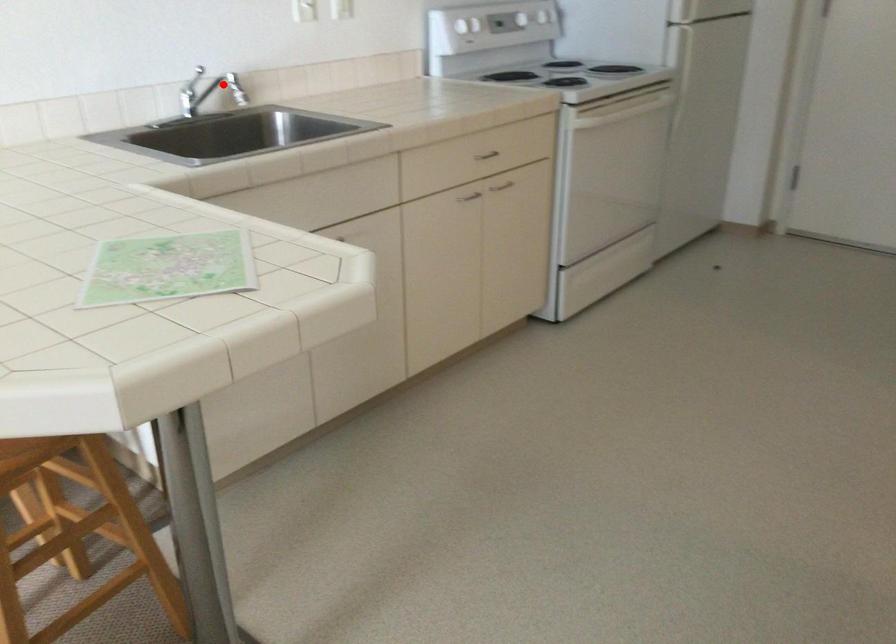
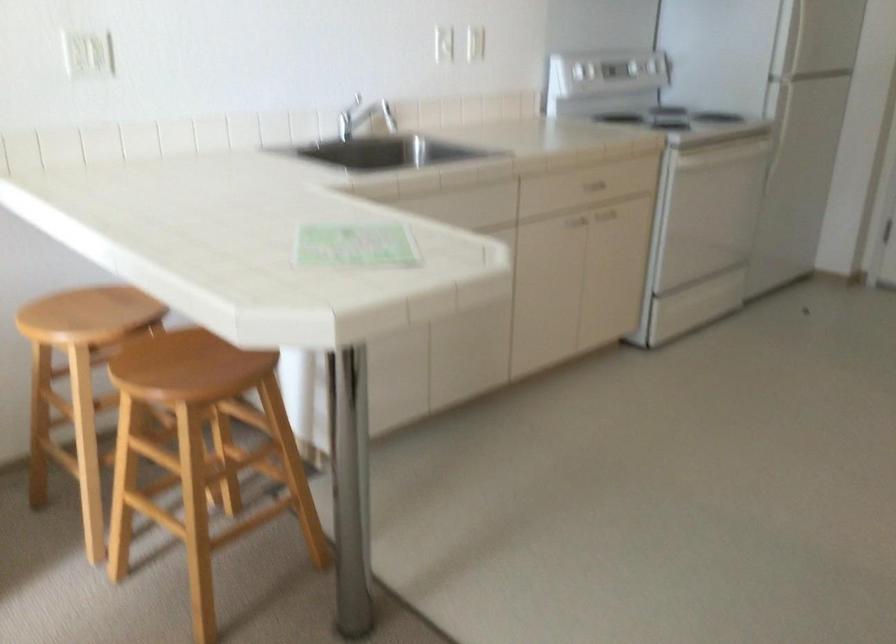
Question: I am providing you with two images of the same scene from different viewpoints. In image1, a red point is highlighted. Considering the same 3D point in image2, which of the following is correct?

Choices:
 (A) It is closer
 (B) It is farther

Answer: (B)